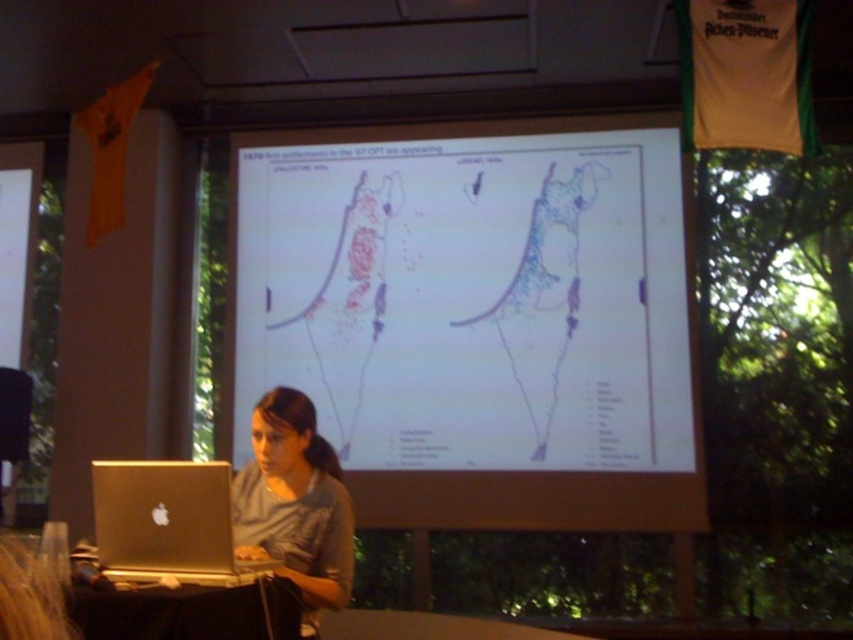
Question: Can you confirm if white matte map at center is positioned above gray fabric shirt at center?

Choices:
 (A) yes
 (B) no

Answer: (A)

Question: Among these points, which one is farthest from the camera?

Choices:
 (A) (625, 412)
 (B) (334, 461)

Answer: (A)

Question: Which point appears farthest from the camera in this image?

Choices:
 (A) (543, 355)
 (B) (231, 506)
 (C) (97, 512)

Answer: (A)

Question: Can you confirm if gray fabric shirt at center is smaller than silver metallic laptop at lower left?

Choices:
 (A) yes
 (B) no

Answer: (B)

Question: From the image, what is the correct spatial relationship of white matte map at center in relation to silver metallic laptop at lower left?

Choices:
 (A) right
 (B) left

Answer: (A)

Question: Which object is closer to the camera taking this photo?

Choices:
 (A) white matte map at center
 (B) silver metallic laptop at lower left

Answer: (B)